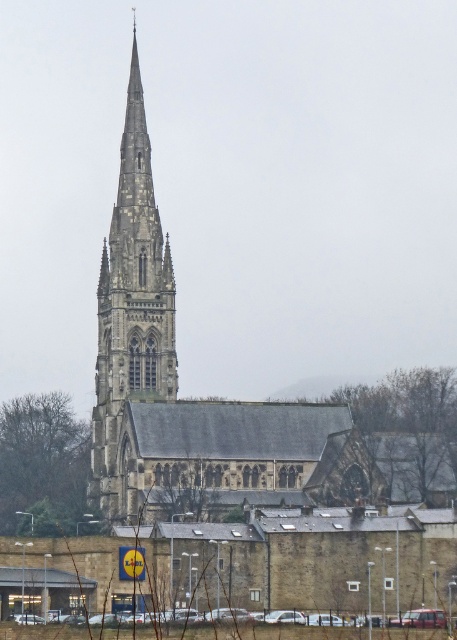
Who is lower down, stone church steeple at center or stone gothic tower at center?

stone church steeple at center is below.

From the picture: Is stone church steeple at center to the right of stone gothic tower at center from the viewer's perspective?

Correct, you'll find stone church steeple at center to the right of stone gothic tower at center.

Identify the location of stone church steeple at center. This screenshot has height=640, width=457. (191, 400).